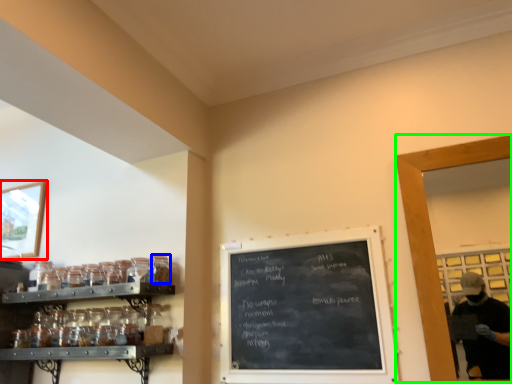
Question: Estimate the real-world distances between objects in this image. Which object is farther from picture frame (highlighted by a red box), glass jar (highlighted by a blue box) or glass door (highlighted by a green box)?

Choices:
 (A) glass jar
 (B) glass door

Answer: (B)